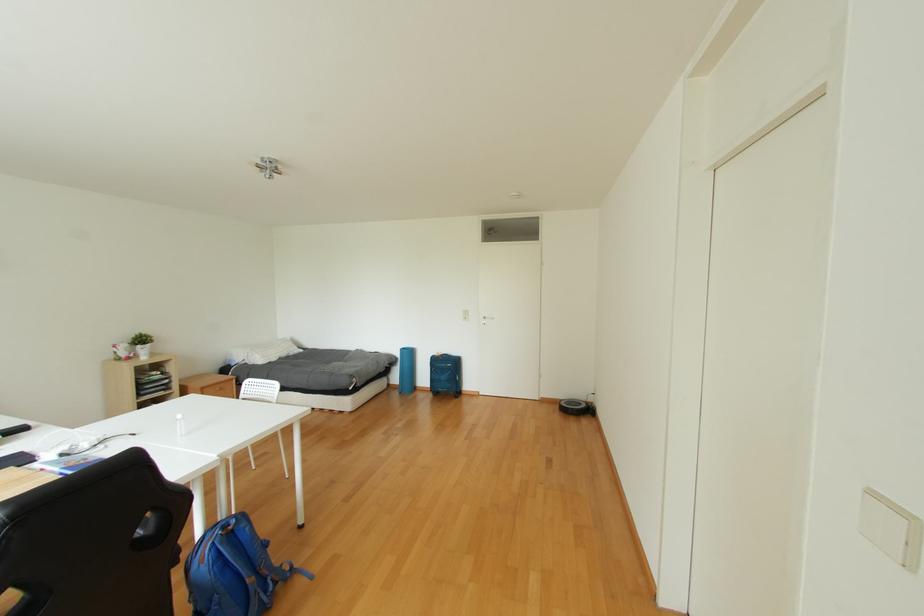
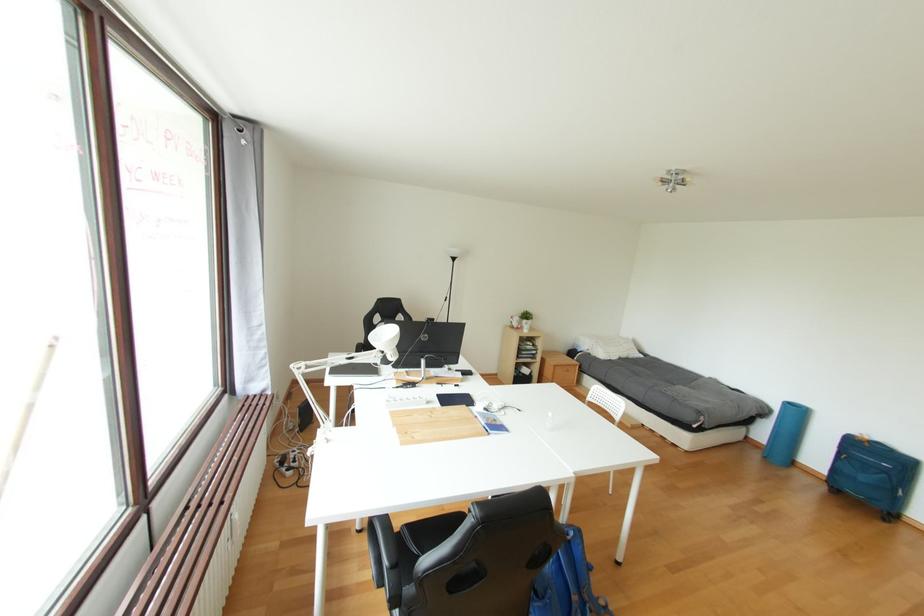
Question: The images are taken continuously from a first-person perspective. In which direction is your viewpoint rotating?

Choices:
 (A) Left
 (B) Right
 (C) Up
 (D) Down

Answer: (A)